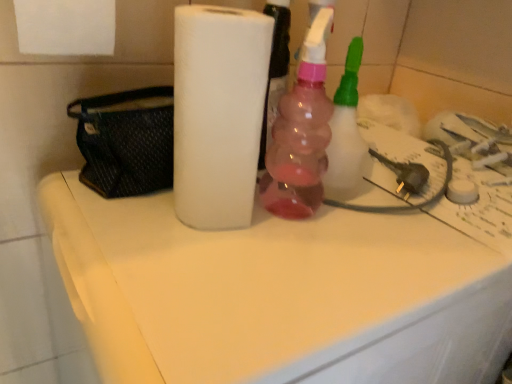
Question: Would you say black mesh pouch at left is inside or outside pink translucent bottle at center?

Choices:
 (A) inside
 (B) outside

Answer: (B)

Question: In terms of width, does black mesh pouch at left look wider or thinner when compared to pink translucent bottle at center?

Choices:
 (A) wide
 (B) thin

Answer: (A)

Question: Estimate the real-world distances between objects in this image. Which object is farther from the black mesh pouch at left?

Choices:
 (A) pink translucent bottle at center
 (B) white matte counter top at center
 (C) white matte paper towel at center

Answer: (B)

Question: Estimate the real-world distances between objects in this image. Which object is farther from the pink translucent bottle at center?

Choices:
 (A) white matte counter top at center
 (B) black mesh pouch at left
 (C) white matte paper towel at center

Answer: (B)